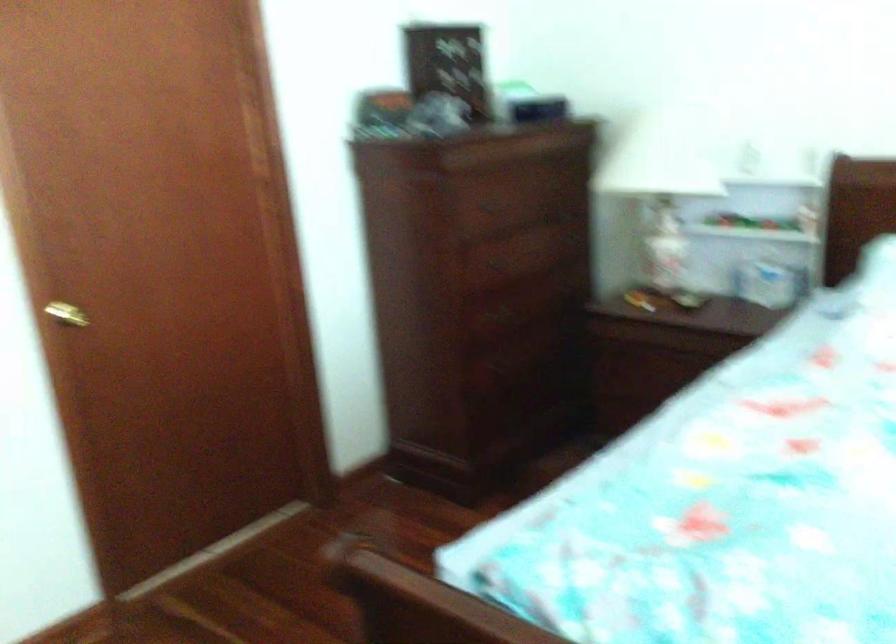
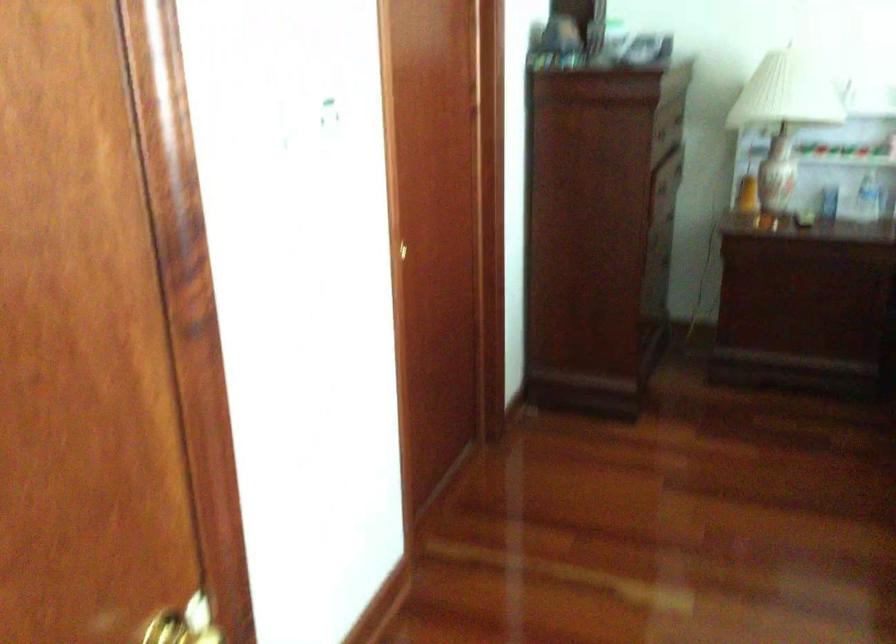
Question: Which direction would the cameraman need to move to produce the second image? Reply with the corresponding letter.

Choices:
 (A) Left
 (B) Right
 (C) Forward
 (D) Backward

Answer: (A)